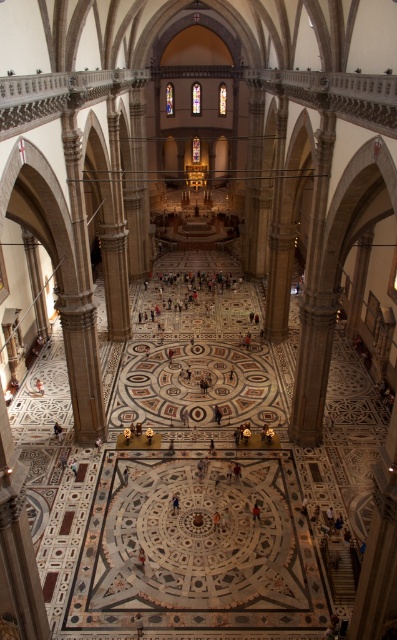
You are standing at the entrance of the cathedral and want to walk towards the central area. There is a red fabric person at center and a dark brown leather shoe at center in your path. Which object will you need to step around first?

The red fabric person at center is wider than the dark brown leather shoe at center, so you will need to step around the red fabric person at center first.

You are standing at the entrance of the cathedral and see a red fabric person at center and a dark blue fabric at center. Which one is wider?

The red fabric person at center might be wider than dark blue fabric at center.